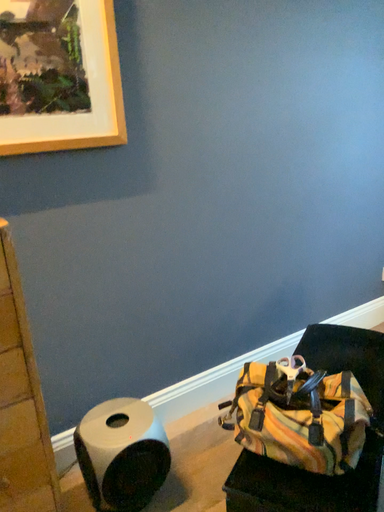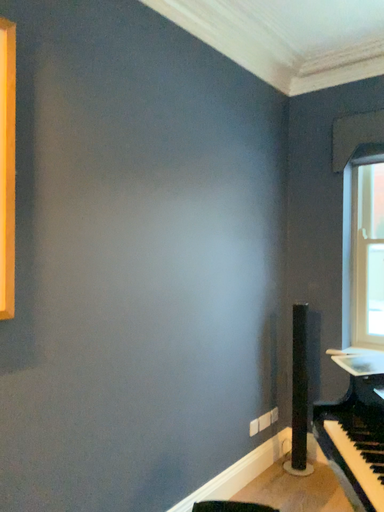
Question: How did the camera likely rotate when shooting the video?

Choices:
 (A) rotated upward
 (B) rotated downward

Answer: (A)